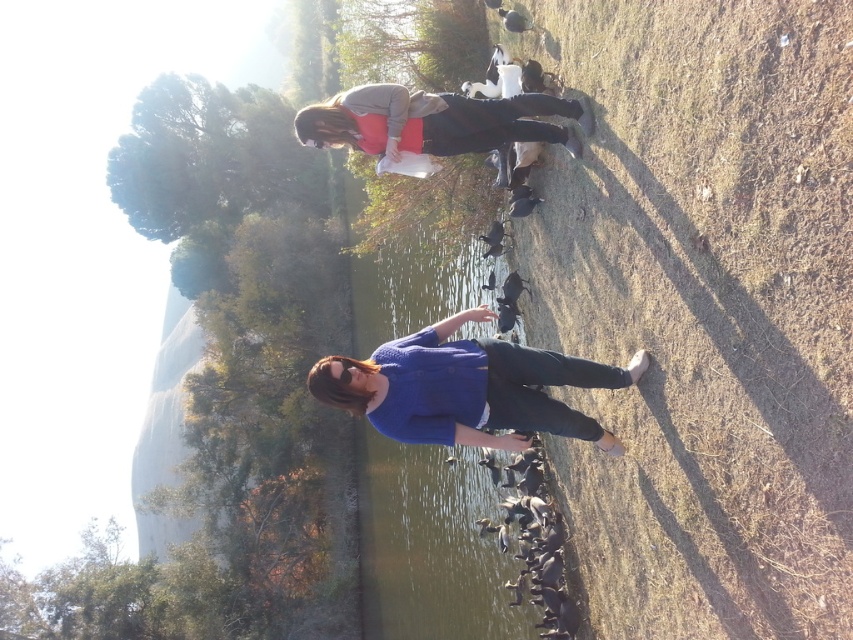
Which is above, clear water at center or blue knitted sweater at center?

blue knitted sweater at center

Which is below, clear water at center or blue knitted sweater at center?

clear water at center

Is point (473, 564) in front of point (363, 364)?

No.

Identify the location of clear water at center. Image resolution: width=853 pixels, height=640 pixels. (431, 547).

Between clear water at center and matte gray sweater at upper center, which one is positioned higher?

matte gray sweater at upper center is above.

Based on the photo, is clear water at center below matte gray sweater at upper center?

Indeed, clear water at center is positioned under matte gray sweater at upper center.

Where is `clear water at center`? Image resolution: width=853 pixels, height=640 pixels. clear water at center is located at coordinates (431, 547).

This screenshot has width=853, height=640. I want to click on clear water at center, so click(x=431, y=547).

Can you confirm if blue knitted sweater at center is smaller than matte gray sweater at upper center?

No, blue knitted sweater at center is not smaller than matte gray sweater at upper center.

Describe the element at coordinates (466, 387) in the screenshot. This screenshot has height=640, width=853. I see `blue knitted sweater at center` at that location.

Is point (314, 369) less distant than point (514, 100)?

Yes, point (314, 369) is in front of point (514, 100).

Locate an element on the screen. The image size is (853, 640). blue knitted sweater at center is located at coordinates (466, 387).